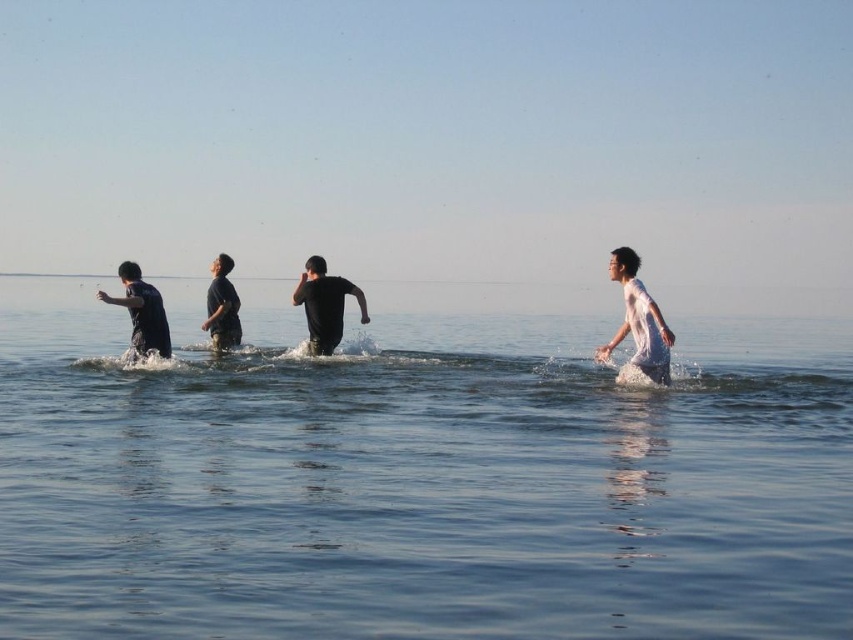
You are standing on the shore and see the clear blue water at center and the matte black shirt at left. Which object is closer to your right side?

The clear blue water at center is positioned on the right side of matte black shirt at left, so the clear blue water at center is closer to your right side.

You are standing at the center of the image and want to locate the white matte shirt at right. Based on the coordinates provided, in which direction should you look to find it?

The white matte shirt at right is located at coordinates point (x=637, y=321). Since you are at the center, looking towards the right side of the image would allow you to find it.